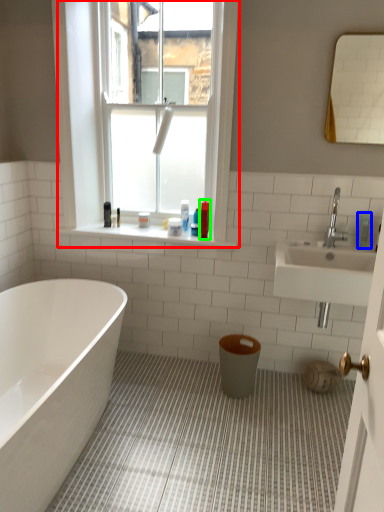
Question: Estimate the real-world distances between objects in this image. Which object is closer to window (highlighted by a red box), toiletry (highlighted by a blue box) or toiletry (highlighted by a green box)?

Choices:
 (A) toiletry
 (B) toiletry

Answer: (B)